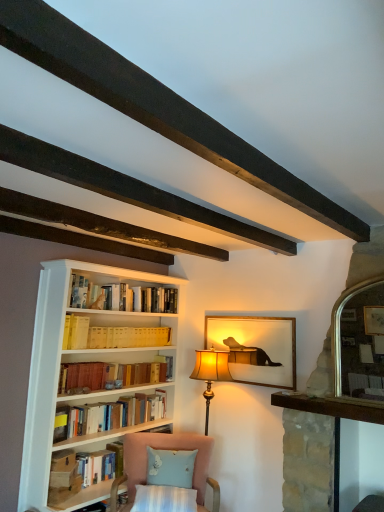
Image resolution: width=384 pixels, height=512 pixels. What do you see at coordinates (167, 449) in the screenshot? I see `pink fabric chair at lower center` at bounding box center [167, 449].

The width and height of the screenshot is (384, 512). In order to click on dark wood beam at upper center in this screenshot , I will do point(156,106).

Image resolution: width=384 pixels, height=512 pixels. Describe the element at coordinates (156, 106) in the screenshot. I see `dark wood beam at upper center` at that location.

What do you see at coordinates (101, 464) in the screenshot? I see `hardcover book at lower left, the third book positioned from the top` at bounding box center [101, 464].

This screenshot has width=384, height=512. In order to click on hardcover books at center, placed as the 2th book when sorted from top to bottom in this screenshot , I will do `click(115, 415)`.

Would you say yellow cardboard book at center, which is the 3th book from bottom to top, is outside hardcover books at center, the 2th book positioned from the bottom?

yellow cardboard book at center, which is the 3th book from bottom to top, is positioned outside hardcover books at center, the 2th book positioned from the bottom.

Would you say yellow cardboard book at center, which is the 3th book from bottom to top, is to the left or to the right of hardcover books at center, placed as the 2th book when sorted from top to bottom, in the picture?

From the image, it's evident that yellow cardboard book at center, which is the 3th book from bottom to top, is to the right of hardcover books at center, placed as the 2th book when sorted from top to bottom.

From a real-world perspective, is yellow cardboard book at center, positioned as the first book in top-to-bottom order, located higher than hardcover books at center, placed as the 2th book when sorted from top to bottom?

Yes.

Considering the sizes of objects yellow cardboard book at center, which is the 3th book from bottom to top, and hardcover books at center, placed as the 2th book when sorted from top to bottom, in the image provided, who is smaller, yellow cardboard book at center, which is the 3th book from bottom to top, or hardcover books at center, placed as the 2th book when sorted from top to bottom,?

With smaller size is yellow cardboard book at center, which is the 3th book from bottom to top.

Which is in front, hardcover book at lower left, placed as the first book when sorted from bottom to top, or pink fabric chair at lower center?

pink fabric chair at lower center is more forward.

Choose the correct answer: Is hardcover book at lower left, placed as the first book when sorted from bottom to top, inside pink fabric chair at lower center or outside it?

hardcover book at lower left, placed as the first book when sorted from bottom to top, is not inside pink fabric chair at lower center, it's outside.

Is hardcover book at lower left, the third book positioned from the top, positioned with its back to pink fabric chair at lower center?

That's not correct — hardcover book at lower left, the third book positioned from the top, is not looking away from pink fabric chair at lower center.

From their relative heights in the image, would you say hardcover book at lower left, placed as the first book when sorted from bottom to top, is taller or shorter than pink fabric chair at lower center?

In the image, hardcover book at lower left, placed as the first book when sorted from bottom to top, appears to be shorter than pink fabric chair at lower center.

Is light blue fabric pillow at lower center touching pink fabric chair at lower center?

No, light blue fabric pillow at lower center is not touching pink fabric chair at lower center.

Find the location of a particular element. This screenshot has height=512, width=384. pillow behind the pink fabric chair at lower center is located at coordinates (170, 467).

Considering the positions of objects light blue fabric pillow at lower center and pink fabric chair at lower center in the image provided, who is more to the right, light blue fabric pillow at lower center or pink fabric chair at lower center?

light blue fabric pillow at lower center is more to the right.

Considering the sizes of objects light blue fabric pillow at lower center and pink fabric chair at lower center in the image provided, who is bigger, light blue fabric pillow at lower center or pink fabric chair at lower center?

With larger size is pink fabric chair at lower center.

From a real-world perspective, is hardcover books at center, the 2th book positioned from the bottom, physically located above or below hardcover book at lower left, the third book positioned from the top?

In terms of real-world spatial position, hardcover books at center, the 2th book positioned from the bottom, is above hardcover book at lower left, the third book positioned from the top.

Who is more distant, hardcover books at center, placed as the 2th book when sorted from top to bottom, or hardcover book at lower left, placed as the first book when sorted from bottom to top?

hardcover book at lower left, placed as the first book when sorted from bottom to top, is further away from the camera.

In the scene shown: From the image's perspective, between hardcover books at center, placed as the 2th book when sorted from top to bottom, and hardcover book at lower left, the third book positioned from the top, which one is located above?

From the image's view, hardcover books at center, placed as the 2th book when sorted from top to bottom, is above.

Measure the distance from hardcover books at center, the 2th book positioned from the bottom, to hardcover book at lower left, placed as the first book when sorted from bottom to top.

hardcover books at center, the 2th book positioned from the bottom, is 11.16 inches away from hardcover book at lower left, placed as the first book when sorted from bottom to top.

Is matte gold picture frame at center positioned far away from dark wood beam at upper center?

Absolutely, matte gold picture frame at center is distant from dark wood beam at upper center.

Is matte gold picture frame at center inside the boundaries of dark wood beam at upper center, or outside?

matte gold picture frame at center is spatially situated outside dark wood beam at upper center.

Which of these two, matte gold picture frame at center or dark wood beam at upper center, stands shorter?

dark wood beam at upper center is shorter.

Would you say dark wood beam at upper center is outside light blue fabric pillow at lower center?

Yes, dark wood beam at upper center is outside of light blue fabric pillow at lower center.

In the scene shown: Does dark wood beam at upper center have a smaller size compared to light blue fabric pillow at lower center?

No, dark wood beam at upper center is not smaller than light blue fabric pillow at lower center.

Can you tell me how much dark wood beam at upper center and light blue fabric pillow at lower center differ in facing direction?

The angular difference between dark wood beam at upper center and light blue fabric pillow at lower center is 49.1 degrees.

Is dark wood beam at upper center positioned far away from light blue fabric pillow at lower center?

Absolutely, dark wood beam at upper center is distant from light blue fabric pillow at lower center.

At what (x,y) coordinates should I click in order to perform the action: click on pillow lying below the matte gold picture frame at center (from the image's perspective). Please return your answer as a coordinate pair (x, y). The height and width of the screenshot is (512, 384). Looking at the image, I should click on (170, 467).

Are light blue fabric pillow at lower center and matte gold picture frame at center located far from each other?

They are positioned close to each other.

Between light blue fabric pillow at lower center and matte gold picture frame at center, which one is positioned in front?

light blue fabric pillow at lower center is closer to the camera.

Is light blue fabric pillow at lower center wider than matte gold picture frame at center?

Indeed, light blue fabric pillow at lower center has a greater width compared to matte gold picture frame at center.

Identify the location of book above the hardcover books at center, placed as the 2th book when sorted from top to bottom (from the image's perspective). (111, 335).

The width and height of the screenshot is (384, 512). What are the coordinates of `chair on the right of hardcover book at lower left, placed as the first book when sorted from bottom to top` in the screenshot? It's located at (167, 449).

Which object lies further to the anchor point pink fabric chair at lower center, light blue fabric pillow at lower center or dark wood beam at upper center?

Among the two, dark wood beam at upper center is located further to pink fabric chair at lower center.

When comparing their distances from pink fabric chair at lower center, does hardcover book at lower left, the third book positioned from the top, or dark wood beam at upper center seem closer?

hardcover book at lower left, the third book positioned from the top.

When comparing their distances from dark wood beam at upper center, does matte gold picture frame at center or hardcover books at center, the 2th book positioned from the bottom, seem closer?

matte gold picture frame at center lies closer to dark wood beam at upper center than the other object.

Looking at the image, which one is located closer to yellow cardboard book at center, which is the 3th book from bottom to top, hardcover book at lower left, the third book positioned from the top, or matte gold picture frame at center?

matte gold picture frame at center is positioned closer to the anchor yellow cardboard book at center, which is the 3th book from bottom to top.

Estimate the real-world distances between objects in this image. Which object is closer to hardcover book at lower left, the third book positioned from the top, hardcover books at center, placed as the 2th book when sorted from top to bottom, or yellow cardboard book at center, which is the 3th book from bottom to top?

hardcover books at center, placed as the 2th book when sorted from top to bottom, is positioned closer to the anchor hardcover book at lower left, the third book positioned from the top.

In the scene shown: From the image, which object appears to be farther from matte gold picture frame at center, dark wood beam at upper center or hardcover books at center, placed as the 2th book when sorted from top to bottom?

dark wood beam at upper center.

From the image, which object appears to be farther from hardcover books at center, the 2th book positioned from the bottom, hardcover book at lower left, placed as the first book when sorted from bottom to top, or matte gold picture frame at center?

matte gold picture frame at center is positioned further to the anchor hardcover books at center, the 2th book positioned from the bottom.

Looking at the image, which one is located further to hardcover book at lower left, placed as the first book when sorted from bottom to top, yellow cardboard book at center, which is the 3th book from bottom to top, or light blue fabric pillow at lower center?

yellow cardboard book at center, which is the 3th book from bottom to top, is positioned further to the anchor hardcover book at lower left, placed as the first book when sorted from bottom to top.

Locate an element on the screen. pillow between matte gold picture frame at center and pink fabric chair at lower center vertically is located at coordinates (170, 467).

The height and width of the screenshot is (512, 384). I want to click on chair between yellow cardboard book at center, which is the 3th book from bottom to top, and hardcover book at lower left, the third book positioned from the top, vertically, so click(x=167, y=449).

This screenshot has width=384, height=512. Identify the location of pillow located between dark wood beam at upper center and yellow cardboard book at center, positioned as the first book in top-to-bottom order, in the depth direction. (170, 467).

Find the location of a particular element. This screenshot has height=512, width=384. pillow between dark wood beam at upper center and matte gold picture frame at center from front to back is located at coordinates (170, 467).